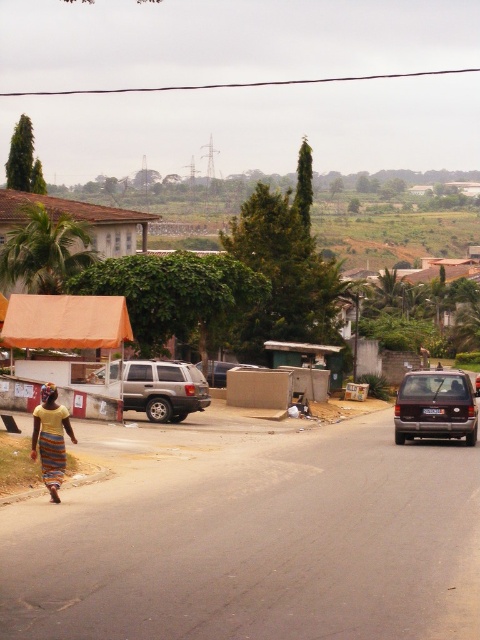
You are a delivery person who needs to park your silver metallic suv at center in a spot near the striped fabric dress at lower left. Can you park the suv to the right of the dress without overlapping?

The silver metallic suv at center is already positioned on the left side of striped fabric dress at lower left, so parking it to the right of the dress would require moving it further to the right. However, since the suv is currently on the left, there might be space available depending on the surrounding area. Check for any obstructions or designated parking spots before proceeding.

You are standing at the center of the road and want to reach the striped fabric dress at lower left. Which direction should you walk to get there?

You should walk towards the left side of the frame to reach the striped fabric dress at lower left.

You are a delivery person trying to park your 2.5 meters wide truck in this street. You see the satin brown van at right and the striped cotton dress at lower left. Which object has a wider width, and can you safely park your truck without hitting either?

The satin brown van at right is wider than the striped cotton dress at lower left. Since the truck is 2.5 meters wide and the van is wider than the dress, you need to ensure there is enough space between them. However, without knowing the exact width of the van, it is uncertain if the truck can safely park without hitting either object.